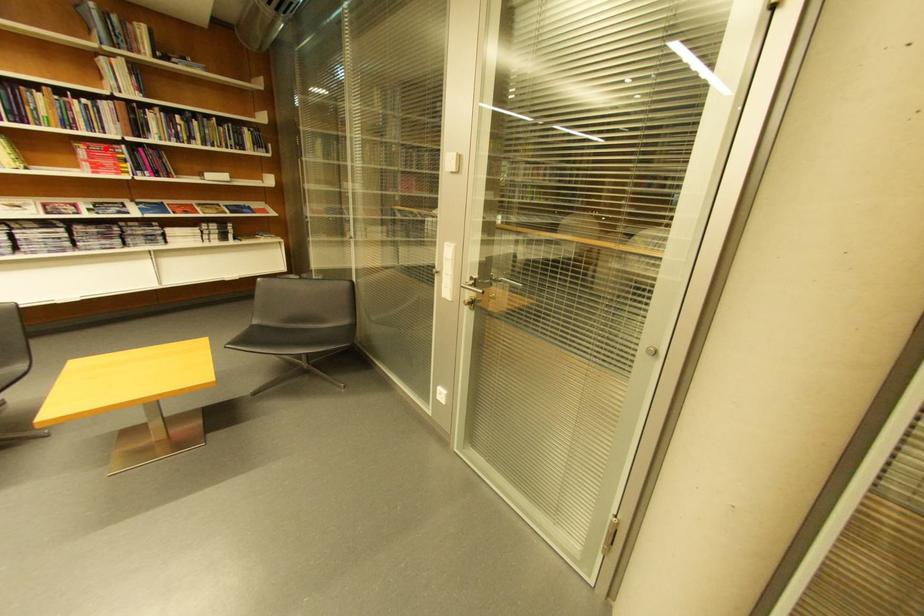
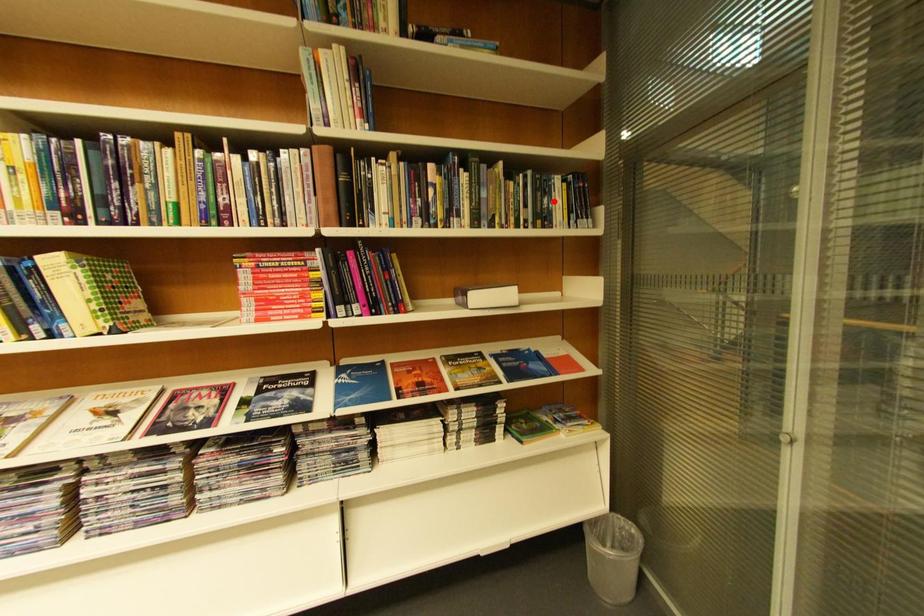
In the scene shown: I am providing you with two images of the same scene from different viewpoints. A red point is marked on the first image and another point is marked on the second image. Is the red point in image1 aligned with the point shown in image2?

No